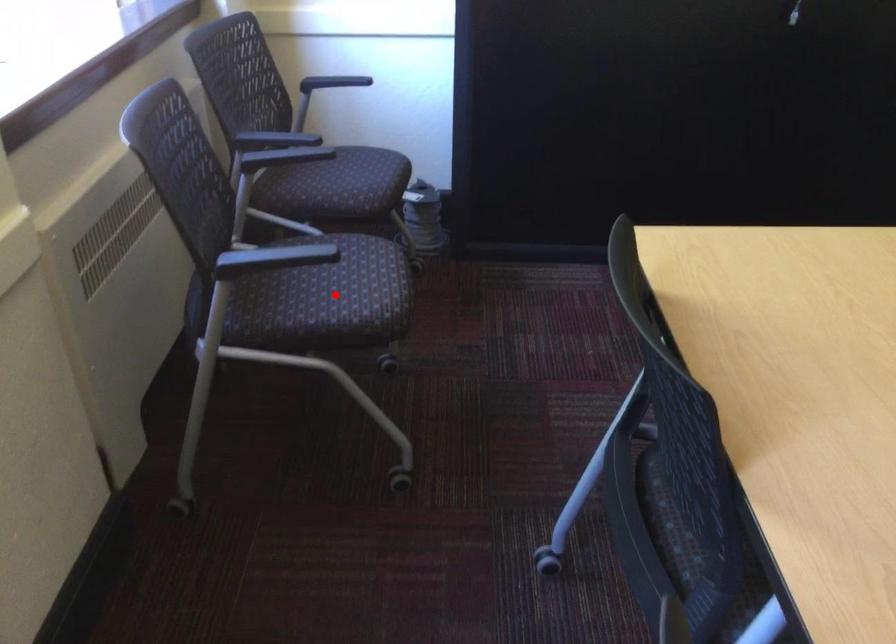
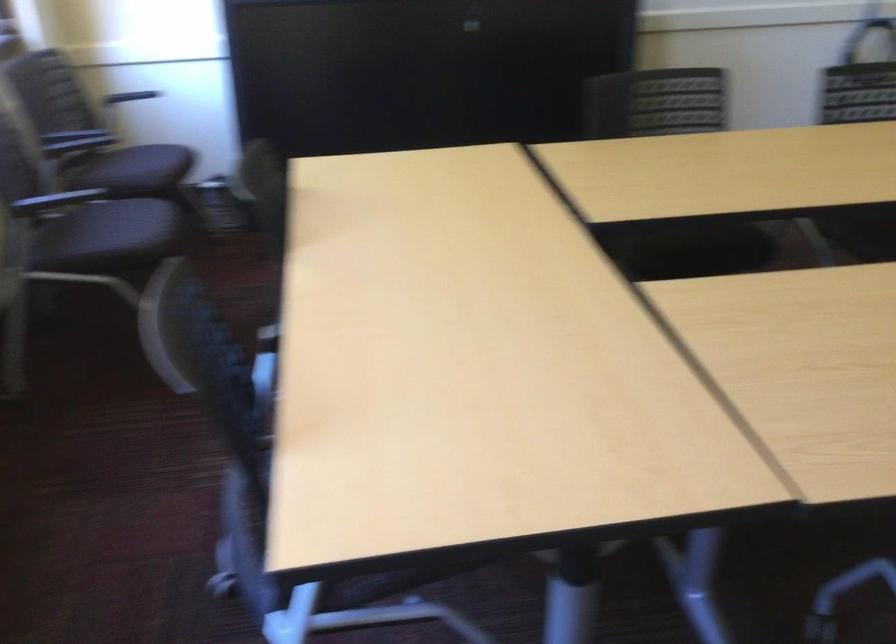
Question: I am providing you with two images of the same scene from different viewpoints. A red point is shown in image1. For the corresponding object point in image2, is it positioned nearer or farther from the camera?

Choices:
 (A) Nearer
 (B) Farther

Answer: (B)